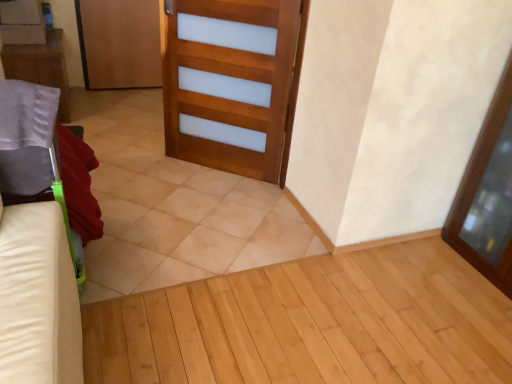
Find the location of a particular element. free space in front of wooden door at center, the 2th door positioned from the back is located at coordinates point(203,233).